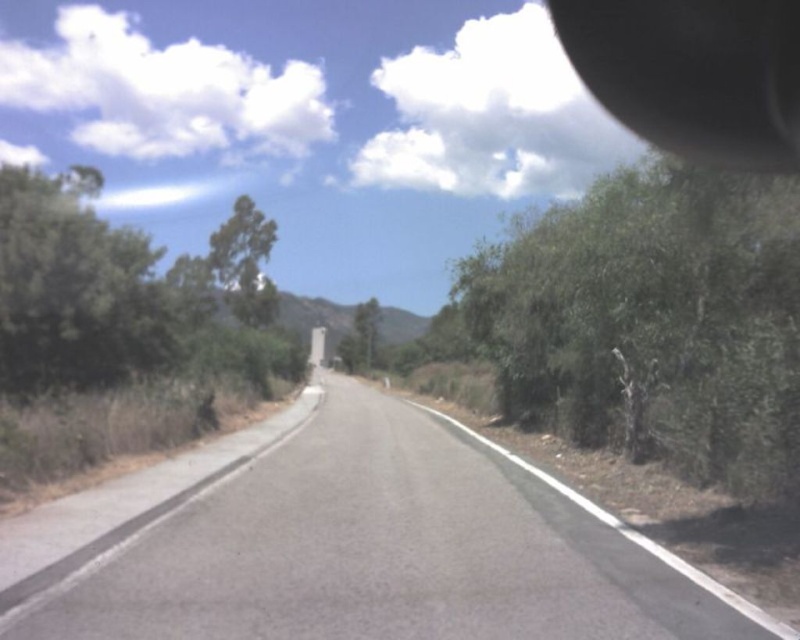
Consider the image. You are driving a car and see the point at (x=340, y=544) in the image. Is this point located on the asphalt road at center?

The point at (x=340, y=544) is located on the asphalt road at center as described in the objects description.

You are a driver approaching the asphalt road at center and the green leafy tree at upper left. Which object will appear closer to you as you look ahead?

The asphalt road at center will appear closer because it is shorter than the green leafy tree at upper left, which is taller and thus farther away.